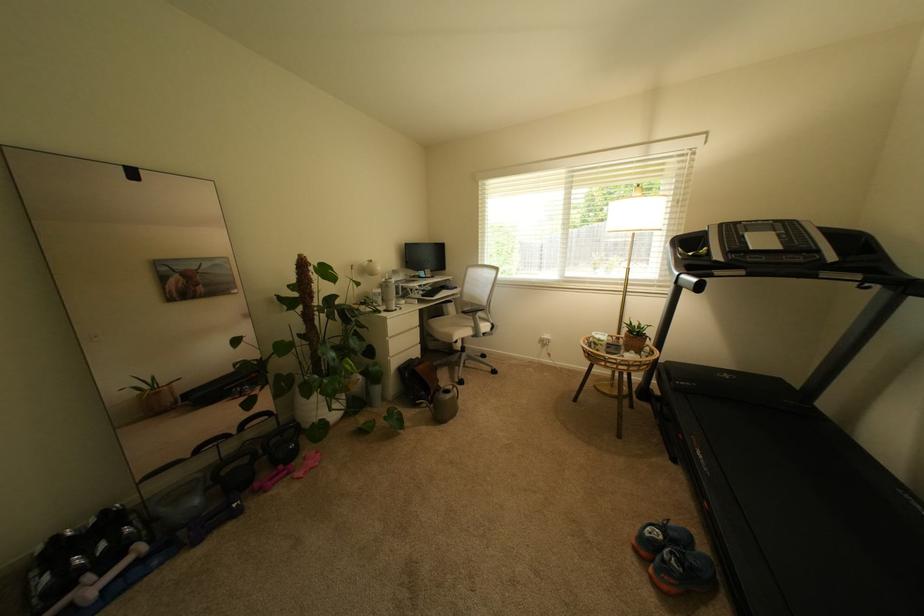
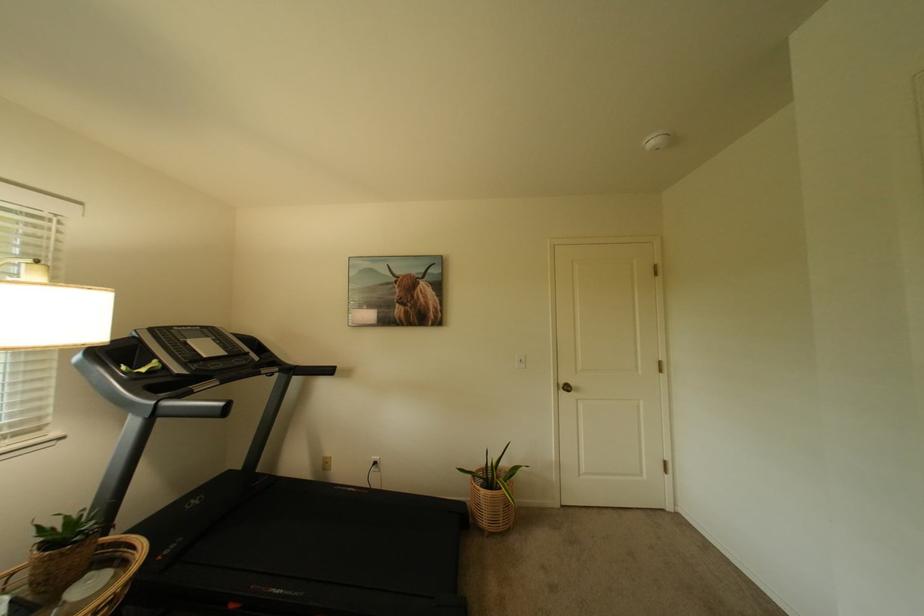
Find the pixel in the second image that matches [723,276] in the first image.

(203, 392)